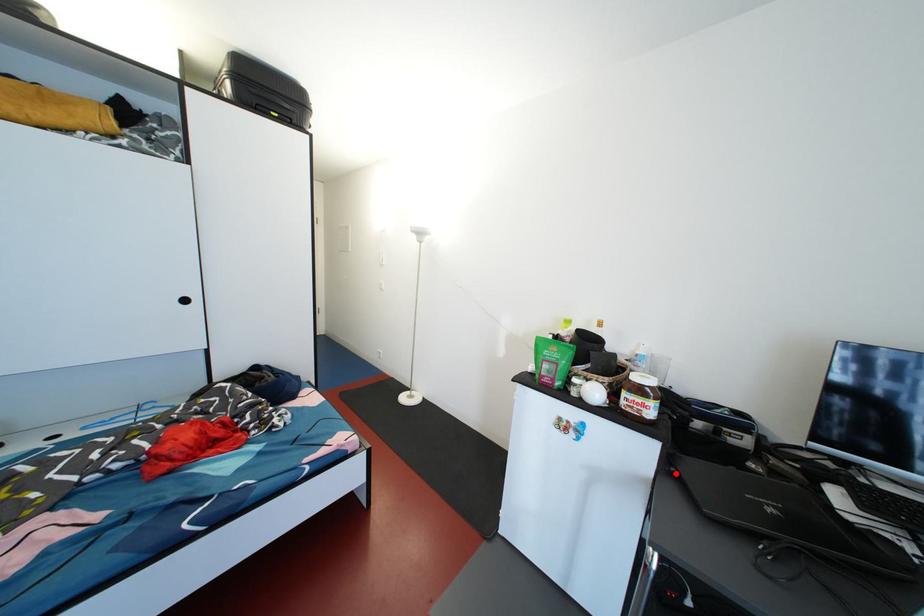
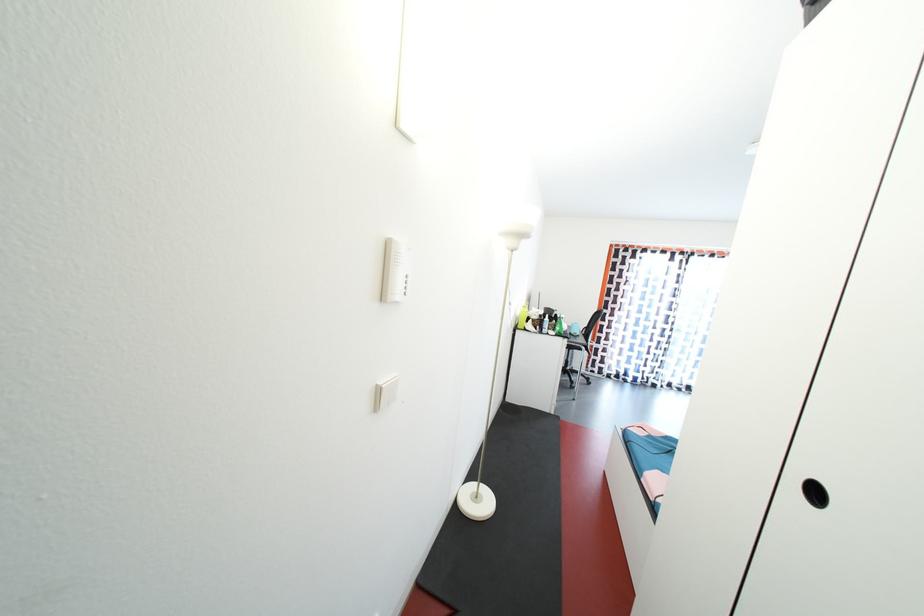
Question: I am providing you with two images of the same scene from different viewpoints. A red point is marked on the first image. At the location where the point appears in image 1, is it still visible in image 2?

Choices:
 (A) Yes
 (B) No

Answer: (B)